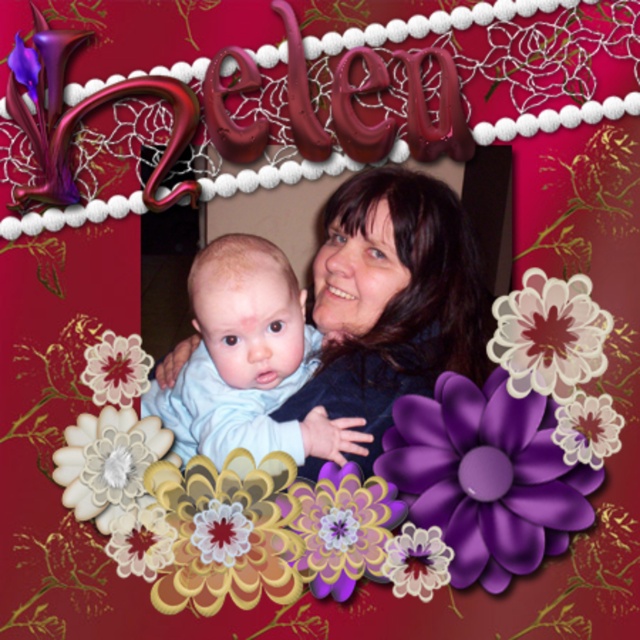
Question: Estimate the real-world distances between objects in this image. Which object is closer to the purple glossy flower at lower center?

Choices:
 (A) light blue fabric baby at center
 (B) purple glossy flower at center
 (C) white paper flower at center
 (D) purple matte flower at center

Answer: (D)

Question: Is matte blue shirt at center positioned at the back of purple glossy flower at lower center?

Choices:
 (A) yes
 (B) no

Answer: (A)

Question: Which of the following is the closest to the observer?

Choices:
 (A) (333, 195)
 (B) (328, 524)
 (C) (120, 369)
 (D) (246, 524)

Answer: (B)

Question: Can you confirm if shiny purple flower at lower right is positioned below matte purple flower at center?

Choices:
 (A) yes
 (B) no

Answer: (B)

Question: Which point is closer to the camera?

Choices:
 (A) matte floral decoration at lower left
 (B) white paper flower at center

Answer: (B)

Question: Does light blue fabric baby at center have a larger size compared to white paper flower at lower left?

Choices:
 (A) no
 (B) yes

Answer: (B)